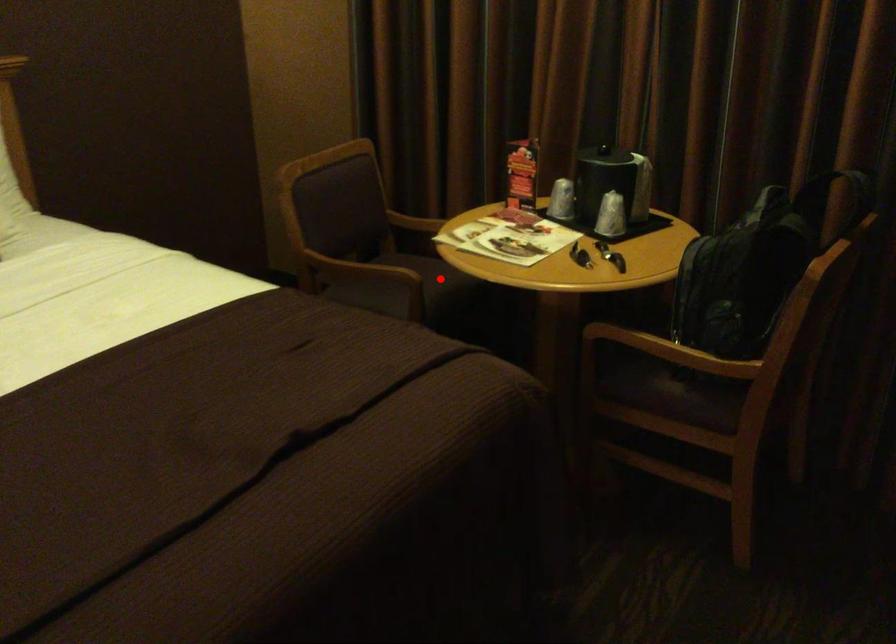
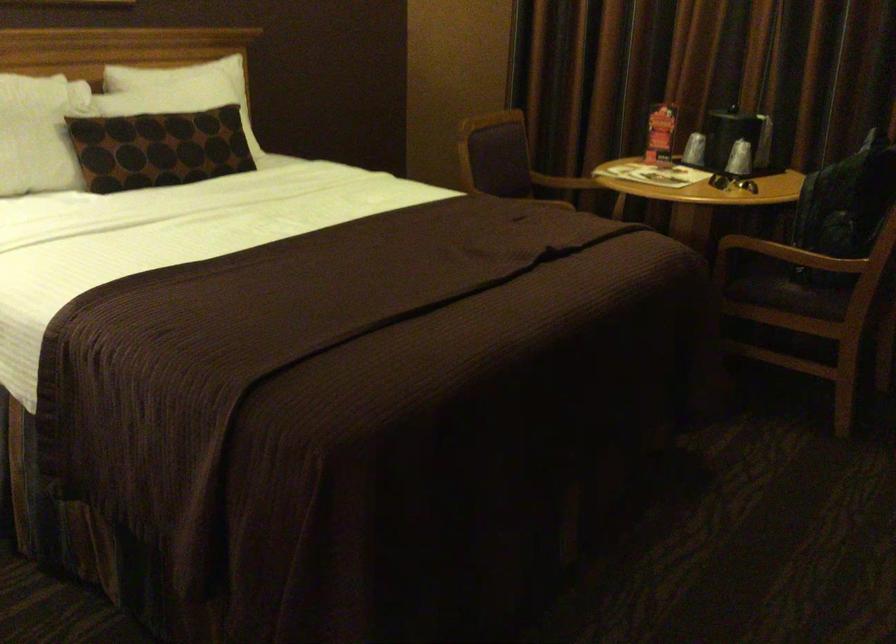
Question: I am providing you with two images of the same scene from different viewpoints. A red point is marked on the first image. Is the red point's position out of view in image 2?

Choices:
 (A) Yes
 (B) No

Answer: (A)